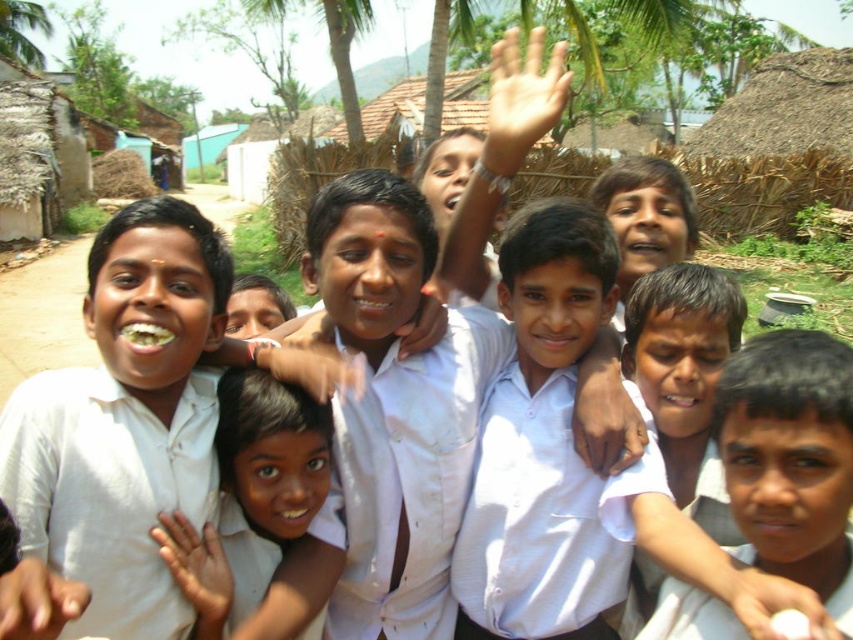
Is white matte shirt at center positioned before smooth skin face at center?

Yes, it is.

Is point (132, 252) positioned before point (209, 618)?

Yes.

Identify the location of white matte shirt at center. The height and width of the screenshot is (640, 853). (131, 424).

In the scene shown: Does white matte shirt at center have a greater height compared to white shirt at center?

Yes.

Is white matte shirt at center above white shirt at center?

Indeed, white matte shirt at center is positioned over white shirt at center.

You are a GUI agent. You are given a task and a screenshot of the screen. Output one action in this format:
    pyautogui.click(x=<x>, y=<y>)
    Task: Click on the white matte shirt at center
    The width and height of the screenshot is (853, 640).
    Given the screenshot: What is the action you would take?
    pyautogui.click(x=131, y=424)

Can you confirm if white shirt at center is smaller than light skin hand at upper center?

Yes, white shirt at center is smaller than light skin hand at upper center.

Is white shirt at center positioned before light skin hand at upper center?

Yes, it is.

At what (x,y) coordinates should I click in order to perform the action: click on white shirt at center. Please return your answer as a coordinate pair (x, y). Looking at the image, I should click on (791, 460).